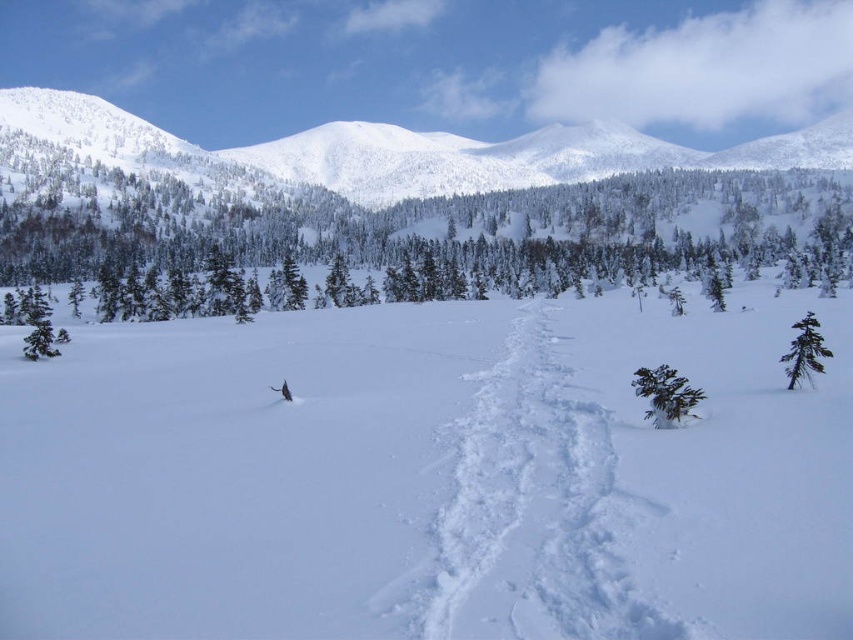
Question: Which point is farther to the camera?

Choices:
 (A) (714, 605)
 (B) (44, 310)

Answer: (B)

Question: Does green textured tree at upper left appear under white snow-covered mountain at upper center?

Choices:
 (A) no
 (B) yes

Answer: (B)

Question: Among these points, which one is farthest from the camera?

Choices:
 (A) (67, 100)
 (B) (666, 365)
 (C) (45, 333)

Answer: (A)

Question: Does white snow at center have a smaller size compared to white snow-covered mountain at upper center?

Choices:
 (A) no
 (B) yes

Answer: (B)

Question: Estimate the real-world distances between objects in this image. Which object is closer to the green matte tree at left?

Choices:
 (A) green matte tree at center
 (B) green textured tree at upper left

Answer: (A)

Question: Is white snow-covered mountain at upper center positioned behind green matte tree at center?

Choices:
 (A) no
 (B) yes

Answer: (B)